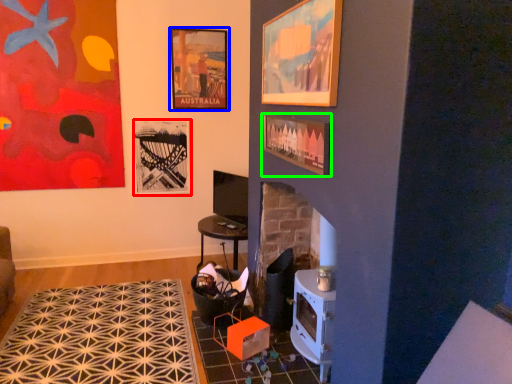
Question: Which object is the farthest from picture frame (highlighted by a red box)? Choose among these: picture frame (highlighted by a blue box) or picture frame (highlighted by a green box).

Choices:
 (A) picture frame
 (B) picture frame

Answer: (B)